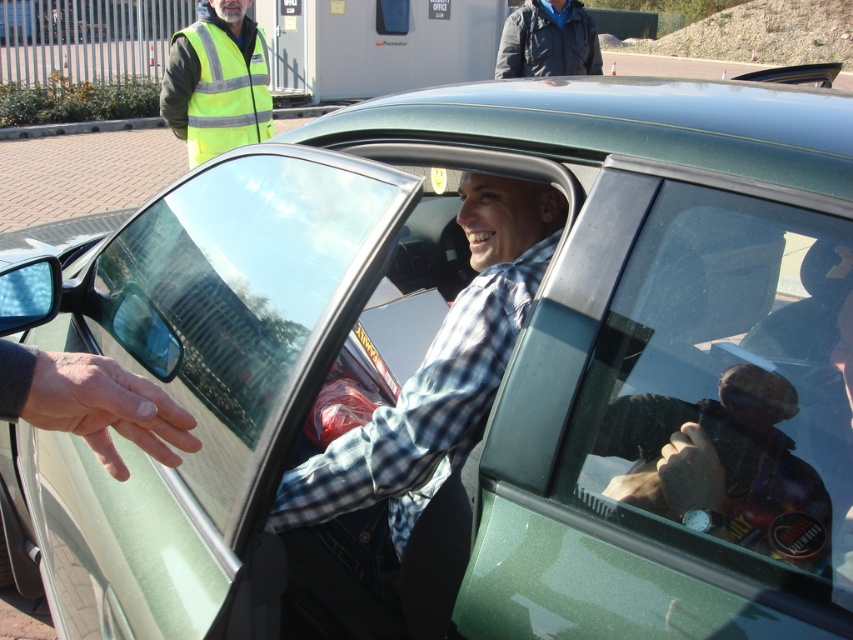
Does checkered fabric shirt at center have a smaller size compared to high-visibility fabric safety vest at upper left?

No, checkered fabric shirt at center is not smaller than high-visibility fabric safety vest at upper left.

Between point (374, 541) and point (247, 122), which one is positioned in front?

Point (374, 541) is in front.

Identify the location of checkered fabric shirt at center. coord(428,404).

Who is positioned more to the left, transparent glass at center or checkered fabric shirt at center?

From the viewer's perspective, checkered fabric shirt at center appears more on the left side.

Which is behind, point (810, 568) or point (492, 333)?

The point (492, 333) is behind.

Where is `transparent glass at center`? The height and width of the screenshot is (640, 853). transparent glass at center is located at coordinates point(726,392).

Is transparent glass at center positioned in front of high-visibility fabric safety vest at upper left?

Yes, transparent glass at center is closer to the viewer.

Which of these two, transparent glass at center or high-visibility fabric safety vest at upper left, stands taller?

Standing taller between the two is high-visibility fabric safety vest at upper left.

Is point (846, 292) positioned before point (215, 148)?

That is True.

Locate an element on the screen. transparent glass at center is located at coordinates 726,392.